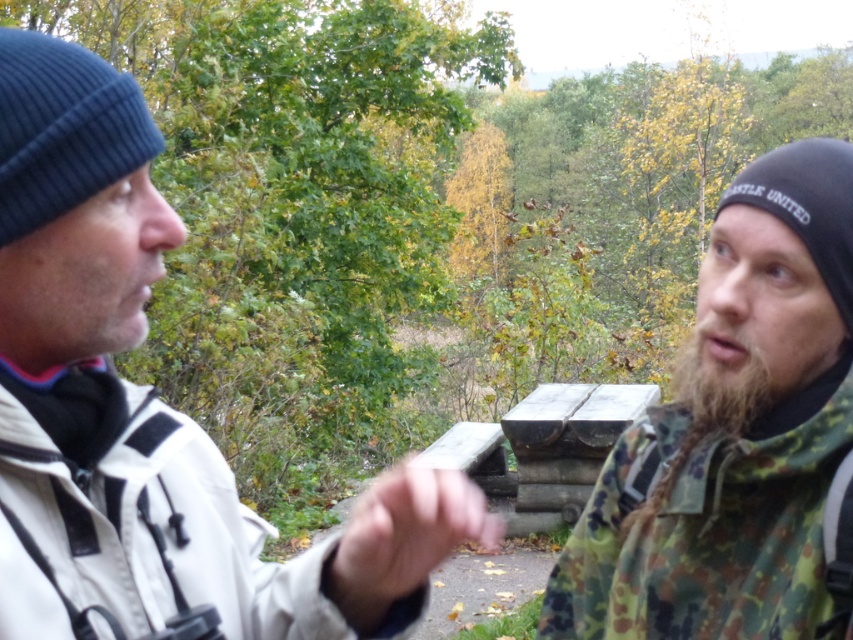
Can you confirm if camouflage jacket at right is thinner than brown fuzzy beard at right?

Incorrect, camouflage jacket at right's width is not less than brown fuzzy beard at right's.

Does camouflage jacket at right appear on the right side of brown fuzzy beard at right?

In fact, camouflage jacket at right is to the left of brown fuzzy beard at right.

Is point (612, 566) farther from camera compared to point (740, 381)?

Yes, point (612, 566) is behind point (740, 381).

Find the location of a particular element. camouflage jacket at right is located at coordinates point(732,432).

Between white matte jacket at left and camouflage fabric hand at center, which one is positioned lower?

camouflage fabric hand at center is lower down.

Which of these two, white matte jacket at left or camouflage fabric hand at center, stands taller?

Standing taller between the two is white matte jacket at left.

Which is in front, point (206, 566) or point (486, 508)?

Point (206, 566)

Where is `white matte jacket at left`? Image resolution: width=853 pixels, height=640 pixels. white matte jacket at left is located at coordinates pos(149,410).

Between camouflage fabric hand at center and brown fuzzy beard at right, which one appears on the right side from the viewer's perspective?

brown fuzzy beard at right

Does point (491, 534) come behind point (691, 340)?

Yes, it is behind point (691, 340).

This screenshot has width=853, height=640. What are the coordinates of `camouflage fabric hand at center` in the screenshot? It's located at (403, 536).